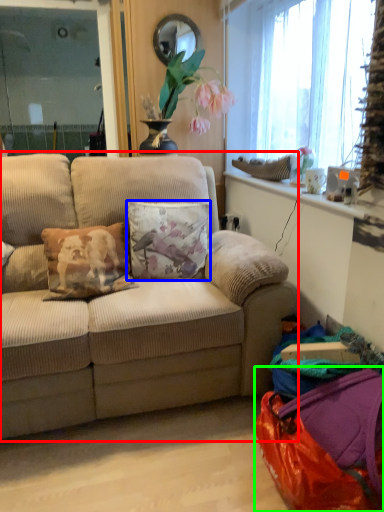
Question: Which is nearer to the studio couch (highlighted by a red box)? pillow (highlighted by a blue box) or bag (highlighted by a green box).

Choices:
 (A) pillow
 (B) bag

Answer: (A)